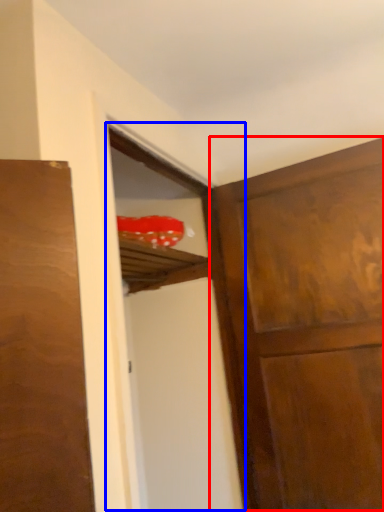
Question: Which point is closer to the camera, door (highlighted by a red box) or screen door (highlighted by a blue box)?

Choices:
 (A) door
 (B) screen door

Answer: (B)